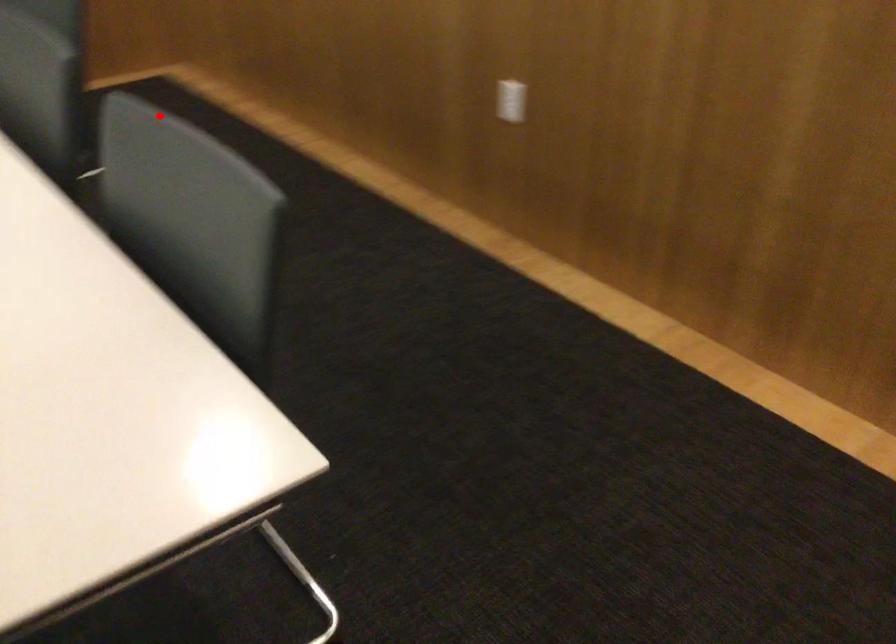
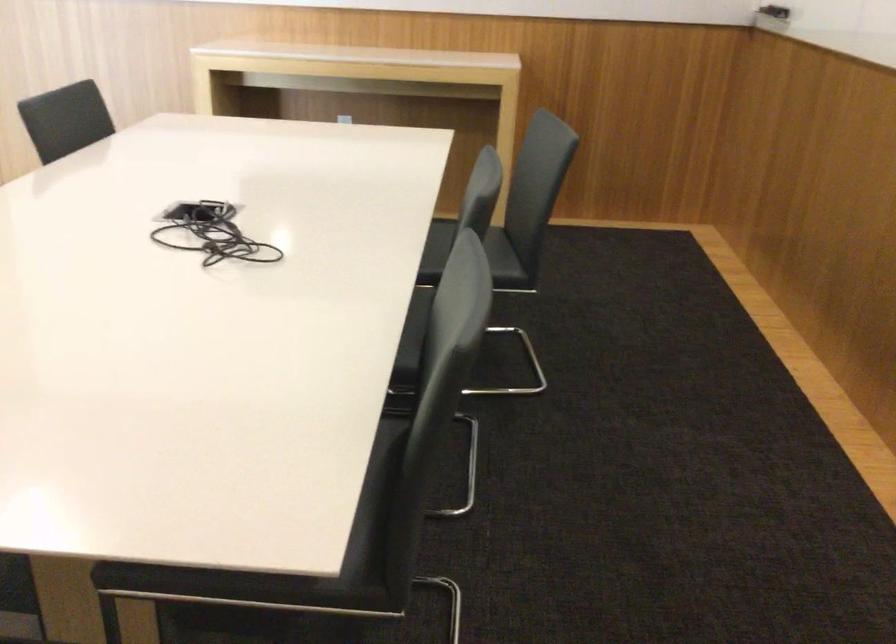
Question: I am providing you with two images of the same scene from different viewpoints. Image1 has a red point marked. In image2, the corresponding 3D location appears at what relative position? Reply with the corresponding letter.

Choices:
 (A) Closer
 (B) Farther

Answer: (B)